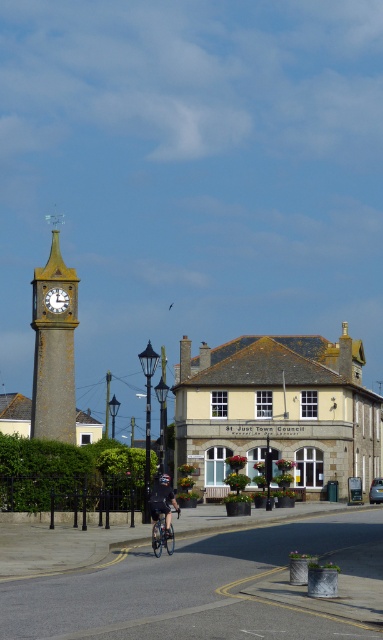
Question: Among these points, which one is nearest to the camera?

Choices:
 (A) (178, 508)
 (B) (68, 330)
 (C) (49, 292)
 (D) (168, 548)

Answer: (D)

Question: Which of the following is the farthest from the observer?

Choices:
 (A) (47, 307)
 (B) (68, 435)
 (C) (171, 525)

Answer: (A)

Question: Which point is closer to the camera?

Choices:
 (A) blue metallic bicycle at center
 (B) stone clock tower at center
 (C) matte gold clock at upper left

Answer: (A)

Question: Is stone clock tower at center smaller than matte gold clock at upper left?

Choices:
 (A) no
 (B) yes

Answer: (A)

Question: Does stone clock tower at center appear on the right side of blue metallic bicycle at center?

Choices:
 (A) no
 (B) yes

Answer: (A)

Question: Is stone clock tower at center positioned at the back of matte gold clock at upper left?

Choices:
 (A) no
 (B) yes

Answer: (A)